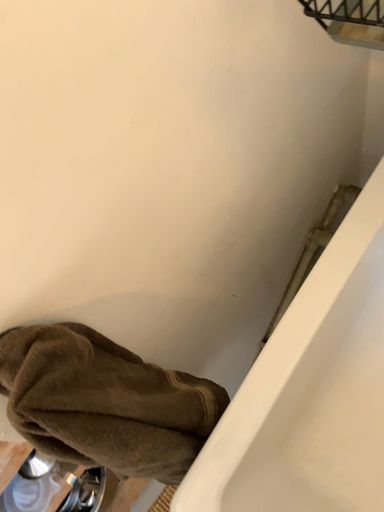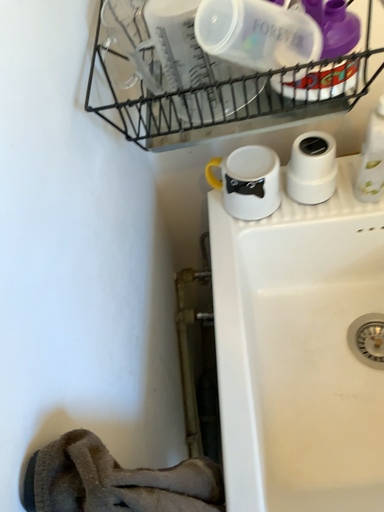
Question: Which way did the camera rotate in the video?

Choices:
 (A) rotated right
 (B) rotated left

Answer: (A)